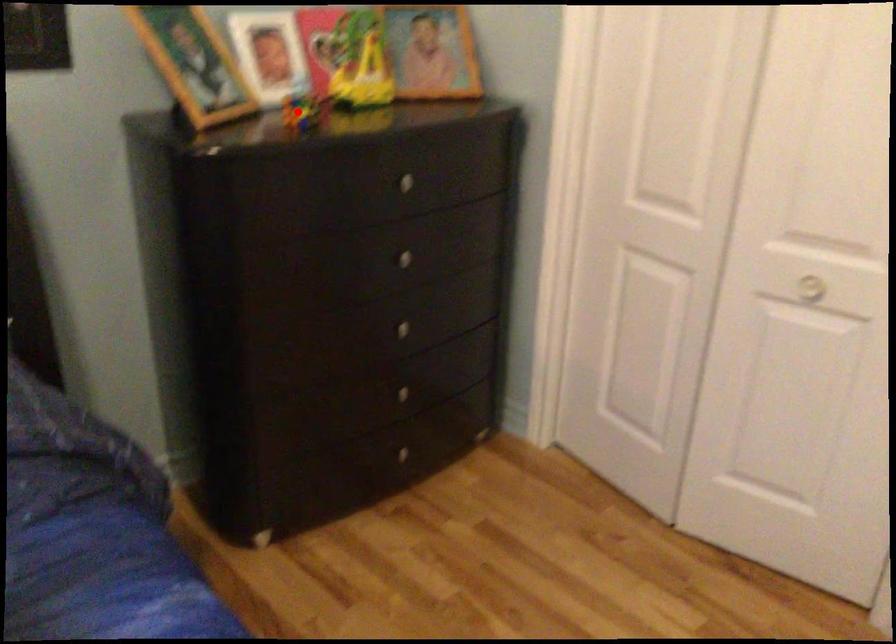
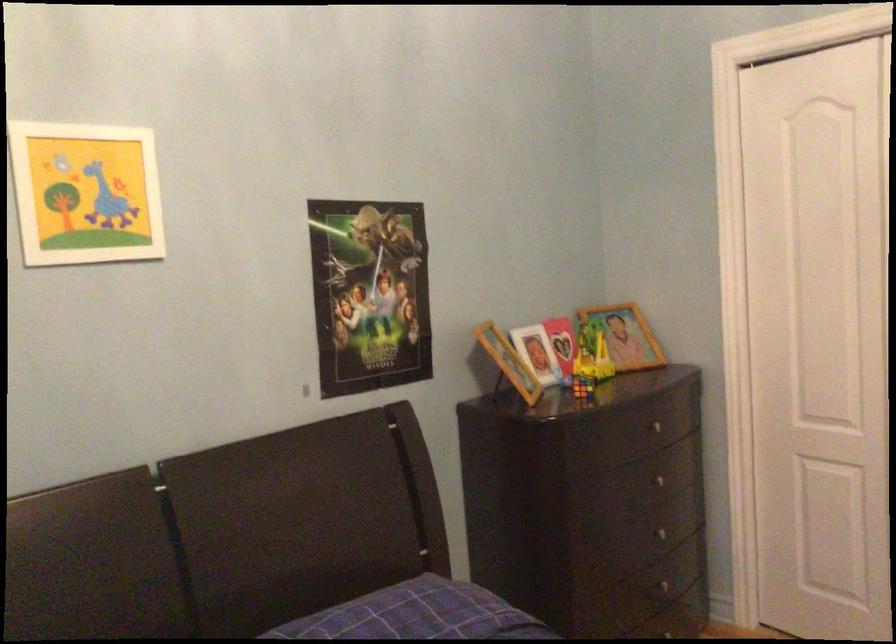
Locate, in the second image, the point that corresponds to the highlighted location in the first image.

(582, 386)